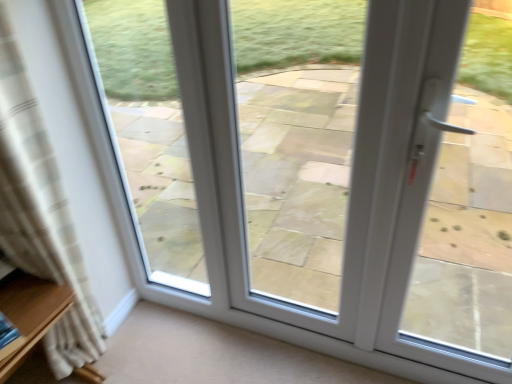
Question: Considering the relative sizes of beige plaid curtain at left and white glass door at left in the image provided, is beige plaid curtain at left shorter than white glass door at left?

Choices:
 (A) no
 (B) yes

Answer: (A)

Question: From the image's perspective, is beige plaid curtain at left below white glass door at left?

Choices:
 (A) yes
 (B) no

Answer: (A)

Question: Considering the relative sizes of beige plaid curtain at left and white glass door at left in the image provided, is beige plaid curtain at left thinner than white glass door at left?

Choices:
 (A) no
 (B) yes

Answer: (A)

Question: Is beige plaid curtain at left completely or partially outside of white glass door at left?

Choices:
 (A) no
 (B) yes

Answer: (B)

Question: Is beige plaid curtain at left oriented towards white glass door at left?

Choices:
 (A) yes
 (B) no

Answer: (B)

Question: Is beige plaid curtain at left in contact with white glass door at left?

Choices:
 (A) yes
 (B) no

Answer: (B)

Question: Is beige plaid curtain at left smaller than white plastic door handle at right?

Choices:
 (A) yes
 (B) no

Answer: (B)

Question: Is beige plaid curtain at left shorter than white plastic door handle at right?

Choices:
 (A) no
 (B) yes

Answer: (A)

Question: Is beige plaid curtain at left far from white plastic door handle at right?

Choices:
 (A) yes
 (B) no

Answer: (A)

Question: Is beige plaid curtain at left completely or partially outside of white plastic door handle at right?

Choices:
 (A) yes
 (B) no

Answer: (A)

Question: From a real-world perspective, is beige plaid curtain at left on top of white plastic door handle at right?

Choices:
 (A) no
 (B) yes

Answer: (A)

Question: Does beige plaid curtain at left touch white plastic door handle at right?

Choices:
 (A) no
 (B) yes

Answer: (A)

Question: Can you confirm if white glass door at center is wider than beige plaid curtain at left?

Choices:
 (A) yes
 (B) no

Answer: (B)